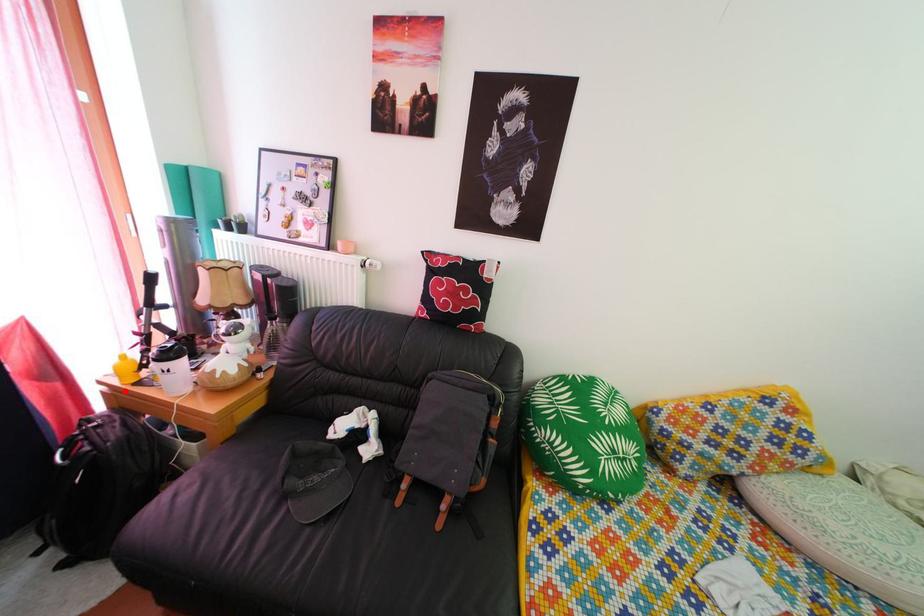
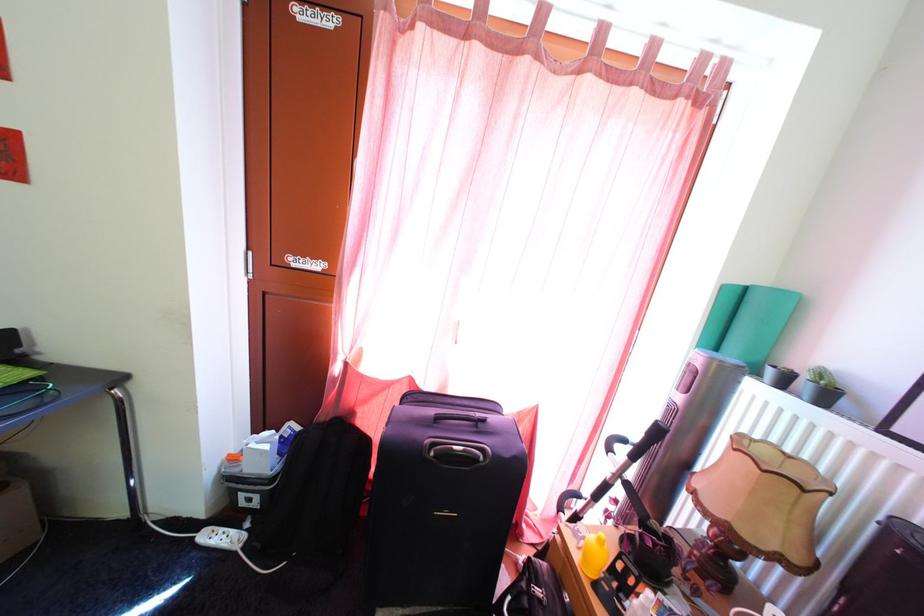
Where in the second image is the point corresponding to the highlighted location from the first image?

(585, 565)